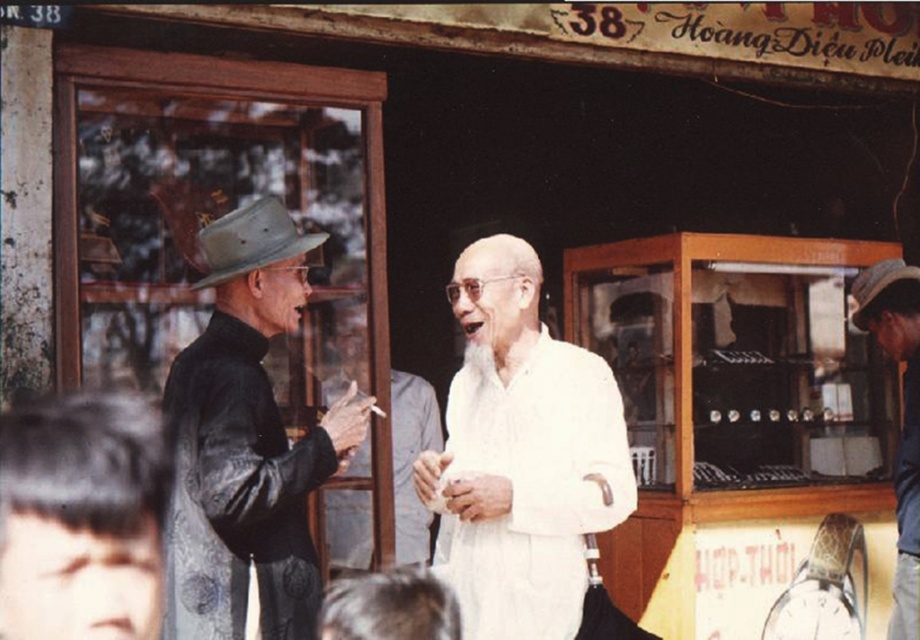
Question: Which point is farther from the camera taking this photo?

Choices:
 (A) (622, 461)
 (B) (880, 273)
 (C) (300, 248)
 (D) (239, 250)

Answer: (B)

Question: Which of the following is the farthest from the observer?

Choices:
 (A) denim jacket at right
 (B) brown leather cowboy hat at left
 (C) white matte/soft fabric at center

Answer: (A)

Question: Does white matte/soft fabric at center appear on the right side of dark gray felt hat at left?

Choices:
 (A) yes
 (B) no

Answer: (A)

Question: Does dark gray felt hat at left appear on the right side of brown leather cowboy hat at left?

Choices:
 (A) yes
 (B) no

Answer: (A)

Question: Which point appears farthest from the camera in this image?

Choices:
 (A) (297, 282)
 (B) (452, 532)
 (C) (899, 298)

Answer: (C)

Question: Is white matte/soft fabric at center to the right of dark gray felt hat at left from the viewer's perspective?

Choices:
 (A) yes
 (B) no

Answer: (A)